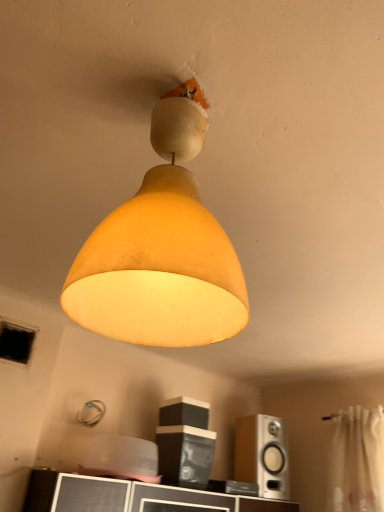
Question: Can we say matte black speaker at center, the 2th speaker when ordered from bottom to top, lies outside silver metallic speaker at lower right, which is the second speaker in left-to-right order?

Choices:
 (A) yes
 (B) no

Answer: (A)

Question: Can you confirm if matte black speaker at center, positioned as the 2th speaker in right-to-left order, is smaller than silver metallic speaker at lower right, acting as the 1th speaker starting from the right?

Choices:
 (A) no
 (B) yes

Answer: (B)

Question: Considering the relative sizes of matte black speaker at center, the 2th speaker when ordered from bottom to top, and silver metallic speaker at lower right, which is the second speaker in top-to-bottom order, in the image provided, is matte black speaker at center, the 2th speaker when ordered from bottom to top, wider than silver metallic speaker at lower right, which is the second speaker in top-to-bottom order,?

Choices:
 (A) yes
 (B) no

Answer: (B)

Question: Does matte black speaker at center, the first speaker positioned from the top, lie in front of silver metallic speaker at lower right, which is the second speaker in left-to-right order?

Choices:
 (A) yes
 (B) no

Answer: (A)

Question: Does matte black speaker at center, positioned as the 2th speaker in right-to-left order, have a larger size compared to silver metallic speaker at lower right, which is the second speaker in top-to-bottom order?

Choices:
 (A) yes
 (B) no

Answer: (B)

Question: Considering the relative sizes of matte black speaker at center, the 1th speaker when ordered from left to right, and silver metallic speaker at lower right, which appears as the 1th speaker when ordered from the bottom, in the image provided, is matte black speaker at center, the 1th speaker when ordered from left to right, shorter than silver metallic speaker at lower right, which appears as the 1th speaker when ordered from the bottom,?

Choices:
 (A) no
 (B) yes

Answer: (B)

Question: Does matte yellow lampshade at center appear on the right side of white sheer curtain at right?

Choices:
 (A) no
 (B) yes

Answer: (A)

Question: Can you confirm if matte yellow lampshade at center is shorter than white sheer curtain at right?

Choices:
 (A) no
 (B) yes

Answer: (A)

Question: Considering the relative positions of matte yellow lampshade at center and white sheer curtain at right in the image provided, is matte yellow lampshade at center in front of white sheer curtain at right?

Choices:
 (A) no
 (B) yes

Answer: (B)

Question: Can you confirm if matte yellow lampshade at center is smaller than white sheer curtain at right?

Choices:
 (A) no
 (B) yes

Answer: (A)

Question: From the image's perspective, does matte yellow lampshade at center appear lower than white sheer curtain at right?

Choices:
 (A) no
 (B) yes

Answer: (A)

Question: Considering the relative sizes of matte yellow lampshade at center and white sheer curtain at right in the image provided, is matte yellow lampshade at center wider than white sheer curtain at right?

Choices:
 (A) yes
 (B) no

Answer: (A)

Question: Is silver metallic speaker at lower right, acting as the 1th speaker starting from the right, closer to the viewer compared to matte black speaker at center, the 1th speaker when ordered from left to right?

Choices:
 (A) no
 (B) yes

Answer: (A)